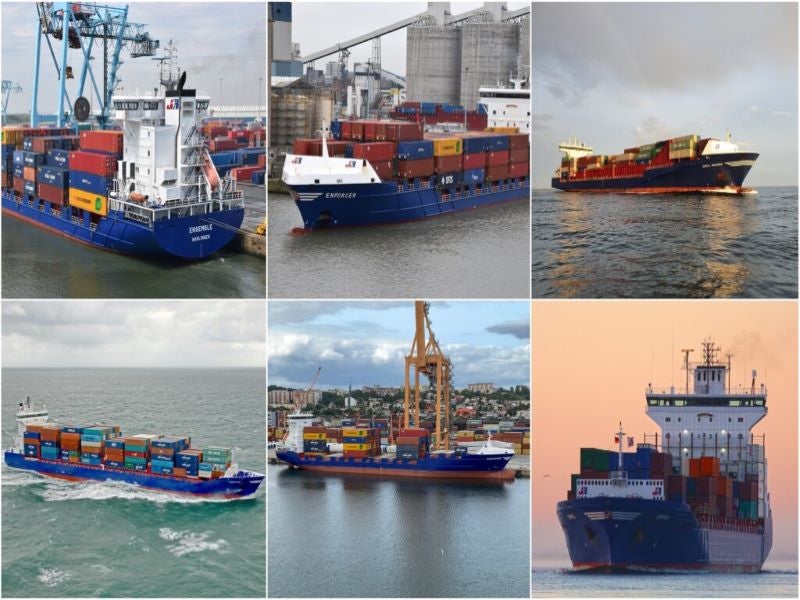
What are the coordinates of `stairs and landings` in the screenshot? It's located at (188, 192), (190, 175), (188, 156), (189, 137), (186, 146), (186, 164), (186, 184), (181, 211), (188, 203).